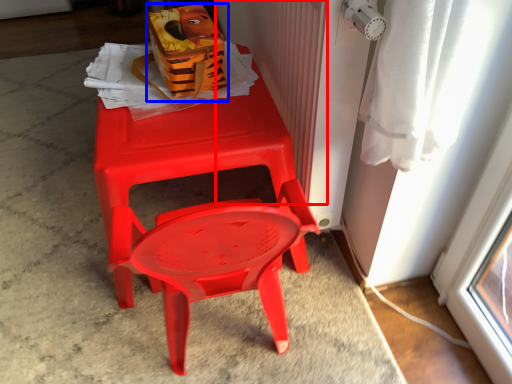
Question: Among these objects, which one is farthest to the camera, radiator (highlighted by a red box) or lunch box (highlighted by a blue box)?

Choices:
 (A) radiator
 (B) lunch box

Answer: (B)